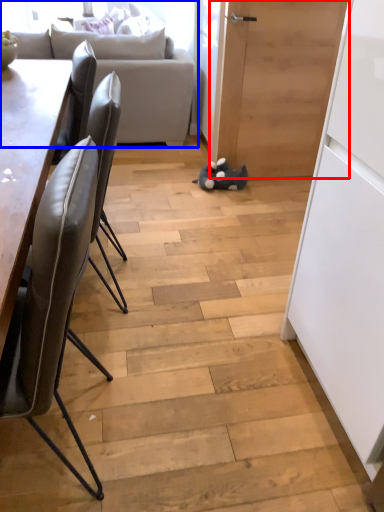
Question: Which point is further to the camera, door (highlighted by a red box) or studio couch (highlighted by a blue box)?

Choices:
 (A) door
 (B) studio couch

Answer: (B)